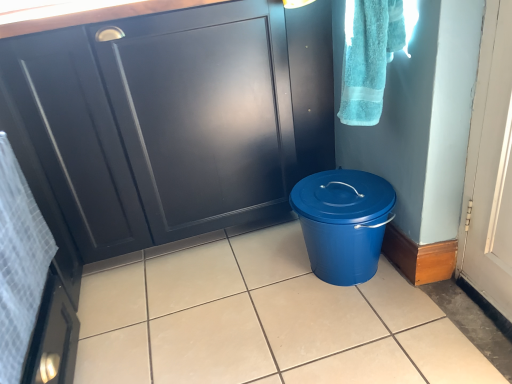
Describe the element at coordinates (368, 57) in the screenshot. The width and height of the screenshot is (512, 384). I see `turquoise cotton towel at upper right, the first bath towel when ordered from right to left` at that location.

What do you see at coordinates (19, 263) in the screenshot?
I see `white textured towel at left, which is counted as the 2th bath towel, starting from the right` at bounding box center [19, 263].

What is the approximate height of white textured towel at left, marked as the 1th bath towel in a left-to-right arrangement?

white textured towel at left, marked as the 1th bath towel in a left-to-right arrangement, is 30.52 inches tall.

Where is `matte blue bucket at center`? matte blue bucket at center is located at coordinates (261, 320).

Locate an element on the screen. The width and height of the screenshot is (512, 384). blue plastic bucket at lower right is located at coordinates (343, 222).

Identify the location of turquoise cotton towel at upper right, marked as the 1th bath towel in a top-to-bottom arrangement. (368, 57).

From a real-world perspective, which object rests below the other?

In real-world perspective, matte black cabinet at center is lower.

Does turquoise cotton towel at upper right, the second bath towel in the bottom-to-top sequence, contain matte black cabinet at center?

Actually, matte black cabinet at center is outside turquoise cotton towel at upper right, the second bath towel in the bottom-to-top sequence.

From the picture: How much distance is there between turquoise cotton towel at upper right, marked as the 1th bath towel in a top-to-bottom arrangement, and matte black cabinet at center?

20.87 inches.

From the image's perspective, is turquoise cotton towel at upper right, marked as the 1th bath towel in a top-to-bottom arrangement, below matte black cabinet at center?

No, from the image's perspective, turquoise cotton towel at upper right, marked as the 1th bath towel in a top-to-bottom arrangement, is not beneath matte black cabinet at center.

Based on their sizes in the image, would you say blue plastic bucket at lower right is bigger or smaller than matte blue bucket at center?

Clearly, blue plastic bucket at lower right is smaller in size than matte blue bucket at center.

Is point (367, 178) behind point (377, 319)?

Yes, point (367, 178) is behind point (377, 319).

Consider the image. Which object is closer to the camera taking this photo, blue plastic bucket at lower right or matte blue bucket at center?

matte blue bucket at center is closer to the camera.

Measure the distance from matte blue bucket at center to matte black cabinet at center.

The distance of matte blue bucket at center from matte black cabinet at center is 19.33 inches.

Looking at this image, from the image's perspective, is matte blue bucket at center located above matte black cabinet at center?

No, from the image's perspective, matte blue bucket at center is not over matte black cabinet at center.

Is matte blue bucket at center taller than matte black cabinet at center?

No.

How far apart are turquoise cotton towel at upper right, positioned as the 2th bath towel in left-to-right order, and matte blue bucket at center?

They are 28.16 inches apart.

From the image's perspective, would you say turquoise cotton towel at upper right, positioned as the 2th bath towel in left-to-right order, is shown under matte blue bucket at center?

Actually, turquoise cotton towel at upper right, positioned as the 2th bath towel in left-to-right order, appears above matte blue bucket at center in the image.

Between turquoise cotton towel at upper right, the first bath towel when ordered from right to left, and matte blue bucket at center, which one appears on the right side from the viewer's perspective?

Positioned to the right is turquoise cotton towel at upper right, the first bath towel when ordered from right to left.

Is turquoise cotton towel at upper right, positioned as the 2th bath towel in left-to-right order, oriented towards matte blue bucket at center?

No, turquoise cotton towel at upper right, positioned as the 2th bath towel in left-to-right order, is not oriented towards matte blue bucket at center.

Between blue plastic bucket at lower right and turquoise cotton towel at upper right, positioned as the 2th bath towel in left-to-right order, which one appears on the left side from the viewer's perspective?

From the viewer's perspective, blue plastic bucket at lower right appears more on the left side.

Which is closer, (382, 213) or (370, 63)?

The point (370, 63) is in front.

Is blue plastic bucket at lower right oriented towards turquoise cotton towel at upper right, marked as the 1th bath towel in a top-to-bottom arrangement?

No.

Is blue plastic bucket at lower right not near turquoise cotton towel at upper right, marked as the 1th bath towel in a top-to-bottom arrangement?

blue plastic bucket at lower right is actually quite close to turquoise cotton towel at upper right, marked as the 1th bath towel in a top-to-bottom arrangement.

Measure the distance between blue plastic bucket at lower right and white textured towel at left, which is counted as the 2th bath towel, starting from the right.

The distance of blue plastic bucket at lower right from white textured towel at left, which is counted as the 2th bath towel, starting from the right, is 31.89 inches.

Is blue plastic bucket at lower right smaller than white textured towel at left, the second bath towel when ordered from top to bottom?

Correct, blue plastic bucket at lower right occupies less space than white textured towel at left, the second bath towel when ordered from top to bottom.

Would you say blue plastic bucket at lower right is outside white textured towel at left, which is counted as the 2th bath towel, starting from the right?

Indeed, blue plastic bucket at lower right is completely outside white textured towel at left, which is counted as the 2th bath towel, starting from the right.

Considering the positions of objects blue plastic bucket at lower right and white textured towel at left, the 1th bath towel in the bottom-to-top sequence, in the image provided, who is more to the right, blue plastic bucket at lower right or white textured towel at left, the 1th bath towel in the bottom-to-top sequence,?

From the viewer's perspective, blue plastic bucket at lower right appears more on the right side.

Is white textured towel at left, marked as the 1th bath towel in a left-to-right arrangement, wider than matte blue bucket at center?

No.

Would you say white textured towel at left, marked as the 1th bath towel in a left-to-right arrangement, is to the left or to the right of matte blue bucket at center in the picture?

Based on their positions, white textured towel at left, marked as the 1th bath towel in a left-to-right arrangement, is located to the left of matte blue bucket at center.

There is a matte blue bucket at center. Identify the location of the 1st bath towel above it (from a real-world perspective). This screenshot has height=384, width=512. (19, 263).

Is white textured towel at left, the second bath towel when ordered from top to bottom, not near matte blue bucket at center?

They are positioned close to each other.

You are a GUI agent. You are given a task and a screenshot of the screen. Output one action in this format:
    pyautogui.click(x=<x>, y=<y>)
    Task: Click on the cabinetry below the turquoise cotton towel at upper right, marked as the 1th bath towel in a top-to-bottom arrangement (from the image's perspective)
    Image resolution: width=512 pixels, height=384 pixels.
    Given the screenshot: What is the action you would take?
    pyautogui.click(x=176, y=118)

Where is `waste container that is behind the matte blue bucket at center`? This screenshot has height=384, width=512. waste container that is behind the matte blue bucket at center is located at coordinates (343, 222).

Looking at this image, which object lies further to the anchor point matte blue bucket at center, matte black cabinet at center or turquoise cotton towel at upper right, the second bath towel in the bottom-to-top sequence?

turquoise cotton towel at upper right, the second bath towel in the bottom-to-top sequence, is positioned further to the anchor matte blue bucket at center.

Looking at the image, which one is located closer to white textured towel at left, marked as the 1th bath towel in a left-to-right arrangement, turquoise cotton towel at upper right, the second bath towel in the bottom-to-top sequence, or matte black cabinet at center?

The object closer to white textured towel at left, marked as the 1th bath towel in a left-to-right arrangement, is matte black cabinet at center.

When comparing their distances from turquoise cotton towel at upper right, marked as the 1th bath towel in a top-to-bottom arrangement, does white textured towel at left, which is counted as the 2th bath towel, starting from the right, or matte blue bucket at center seem closer?

matte blue bucket at center lies closer to turquoise cotton towel at upper right, marked as the 1th bath towel in a top-to-bottom arrangement, than the other object.

Based on their spatial positions, is blue plastic bucket at lower right or turquoise cotton towel at upper right, marked as the 1th bath towel in a top-to-bottom arrangement, further from white textured towel at left, the second bath towel when ordered from top to bottom?

The object further to white textured towel at left, the second bath towel when ordered from top to bottom, is turquoise cotton towel at upper right, marked as the 1th bath towel in a top-to-bottom arrangement.

Considering their positions, is matte black cabinet at center positioned further to blue plastic bucket at lower right than matte blue bucket at center?

matte black cabinet at center is further to blue plastic bucket at lower right.

Which object lies nearer to the anchor point turquoise cotton towel at upper right, positioned as the 2th bath towel in left-to-right order, matte blue bucket at center or blue plastic bucket at lower right?

blue plastic bucket at lower right lies closer to turquoise cotton towel at upper right, positioned as the 2th bath towel in left-to-right order, than the other object.

Which object lies further to the anchor point matte blue bucket at center, blue plastic bucket at lower right or matte black cabinet at center?

Based on the image, matte black cabinet at center appears to be further to matte blue bucket at center.

From the image, which object appears to be farther from matte blue bucket at center, turquoise cotton towel at upper right, positioned as the 2th bath towel in left-to-right order, or white textured towel at left, marked as the 1th bath towel in a left-to-right arrangement?

turquoise cotton towel at upper right, positioned as the 2th bath towel in left-to-right order.

This screenshot has height=384, width=512. I want to click on waste container between matte black cabinet at center and turquoise cotton towel at upper right, the second bath towel in the bottom-to-top sequence, so click(x=343, y=222).

What are the coordinates of `waste container between white textured towel at left, which is counted as the 2th bath towel, starting from the right, and turquoise cotton towel at upper right, the second bath towel in the bottom-to-top sequence` in the screenshot? It's located at (343, 222).

At what (x,y) coordinates should I click in order to perform the action: click on cabinetry between white textured towel at left, marked as the 1th bath towel in a left-to-right arrangement, and turquoise cotton towel at upper right, marked as the 1th bath towel in a top-to-bottom arrangement. Please return your answer as a coordinate pair (x, y). The height and width of the screenshot is (384, 512). Looking at the image, I should click on (176, 118).

Locate an element on the screen. This screenshot has width=512, height=384. tile located between white textured towel at left, the second bath towel when ordered from top to bottom, and matte black cabinet at center in the depth direction is located at coordinates (261, 320).